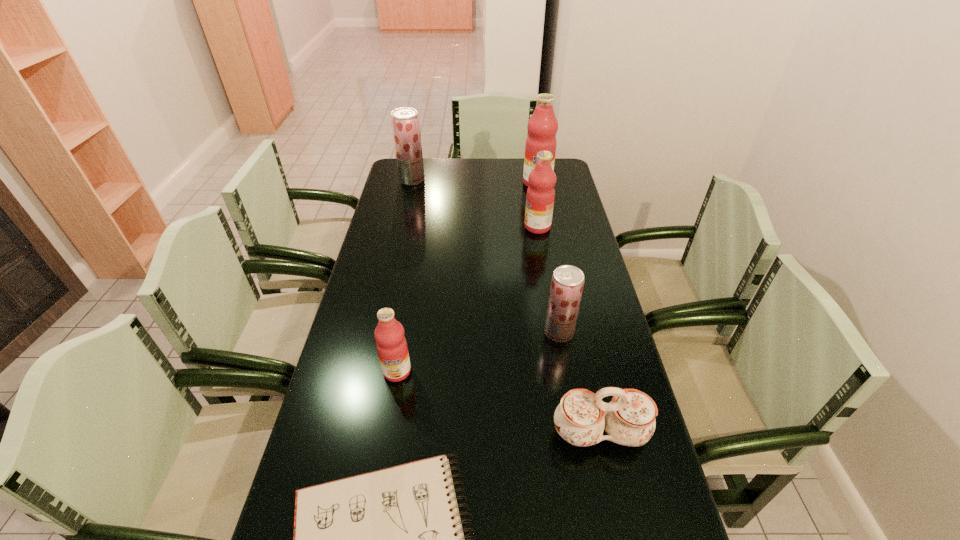
The height and width of the screenshot is (540, 960). Find the location of `object that is the sixth nearest to the fourth nearest object`. object that is the sixth nearest to the fourth nearest object is located at coordinates (405, 123).

You are a GUI agent. You are given a task and a screenshot of the screen. Output one action in this format:
    pyautogui.click(x=<x>, y=<y>)
    Task: Click on the closest object to the leftmost pink fruit juice
    
    Given the screenshot: What is the action you would take?
    pyautogui.click(x=392, y=539)

Locate an element on the screen. The image size is (960, 540). the closest fruit juice to the sixth farthest object is located at coordinates (567, 283).

The height and width of the screenshot is (540, 960). I want to click on fruit juice that stands as the second closest to the shortest object, so click(567, 283).

Locate an element on the screen. pink fruit juice that can be found as the third closest to the bigger strawberry fruit juice is located at coordinates (392, 349).

You are a GUI agent. You are given a task and a screenshot of the screen. Output one action in this format:
    pyautogui.click(x=<x>, y=<y>)
    Task: Click on the pink fruit juice that can be found as the closest to the third nearest object
    
    Given the screenshot: What is the action you would take?
    pyautogui.click(x=540, y=196)

The height and width of the screenshot is (540, 960). I want to click on vacant point that satisfies the following two spatial constraints: 1. on the label of the fifth nearest object; 2. on the label of the leftmost pink fruit juice, so click(x=562, y=371).